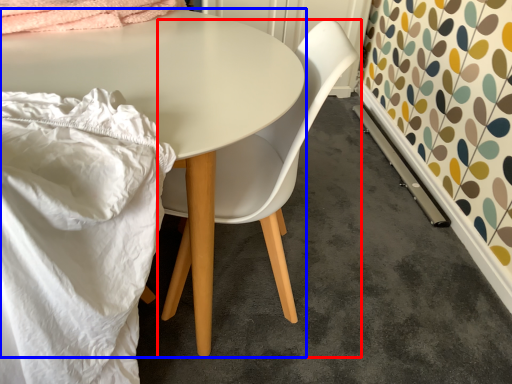
Question: Which of the following is the farthest to the observer, chair (highlighted by a red box) or table (highlighted by a blue box)?

Choices:
 (A) chair
 (B) table

Answer: (A)